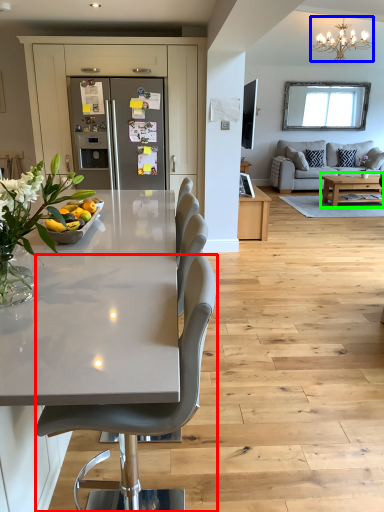
Question: Which is farther away from chair (highlighted by a red box)? light fixture (highlighted by a blue box) or coffee table (highlighted by a green box)?

Choices:
 (A) light fixture
 (B) coffee table

Answer: (A)